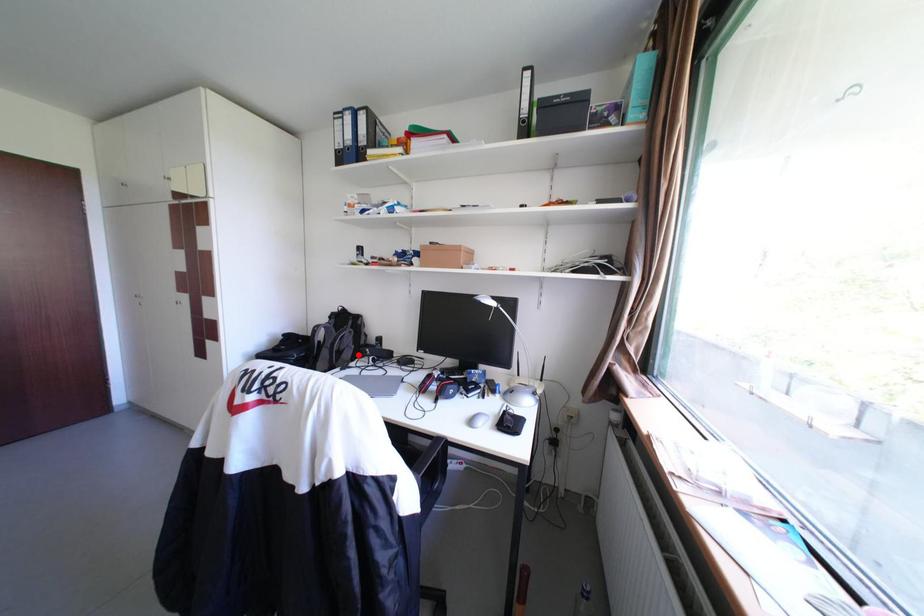
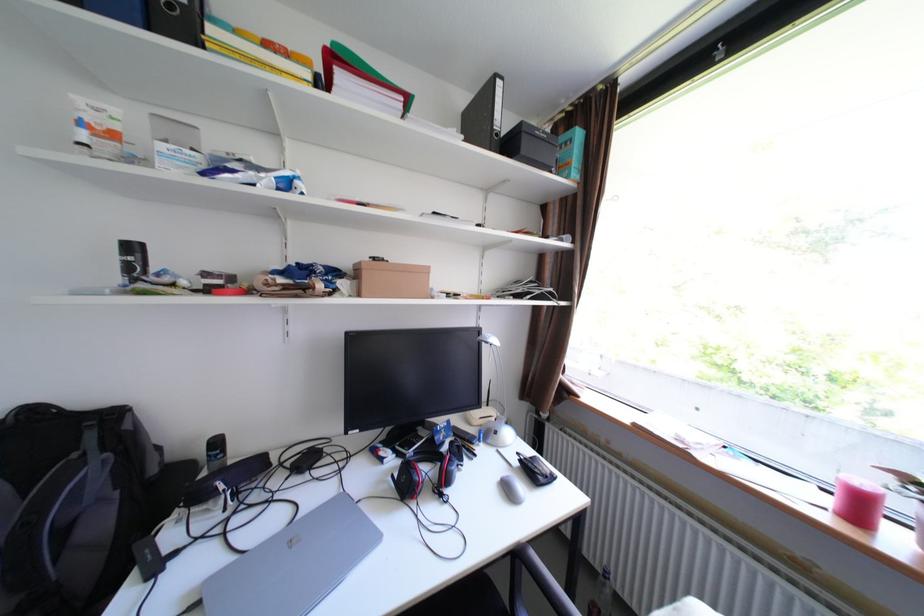
Locate, in the second image, the point that corresponds to the highlighted location in the first image.

(110, 524)